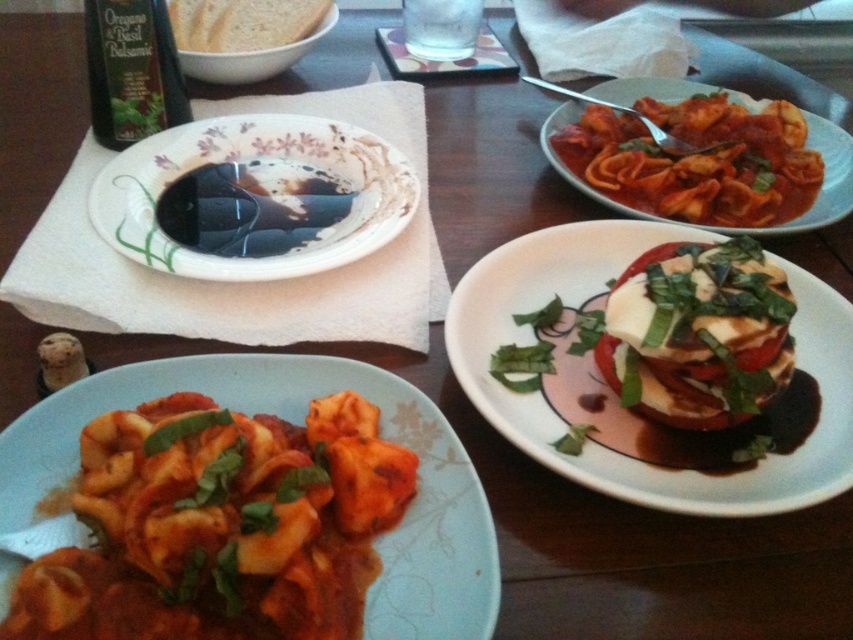
You are a guest at the table and want to reach for the matte tortellini at lower left and the white glossy plate at upper left. Which one is closer to you?

The matte tortellini at lower left is closer to you since it is to the right of the white glossy plate at upper left, indicating its position relative to your perspective.

You are looking at the dining table described in the scene. Where is the matte tortellini at lower left located in terms of its 2D coordinates?

The matte tortellini at lower left is located at the 2D coordinates point [219,525].